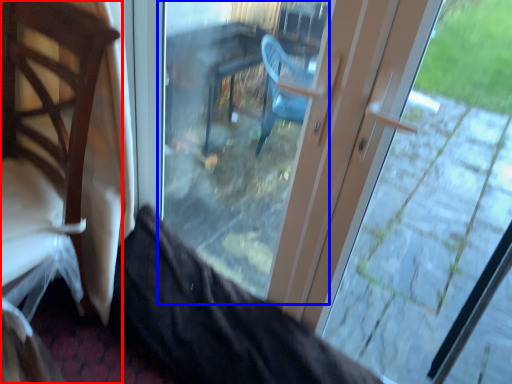
Question: Which point is further to the camera, chair (highlighted by a red box) or glass door (highlighted by a blue box)?

Choices:
 (A) chair
 (B) glass door

Answer: (B)